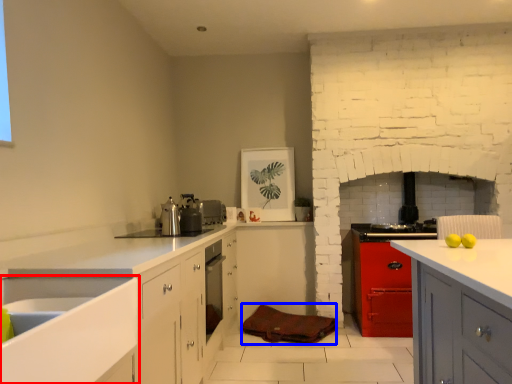
Question: Which object is closer to the camera taking this photo, sink (highlighted by a red box) or material (highlighted by a blue box)?

Choices:
 (A) sink
 (B) material

Answer: (A)